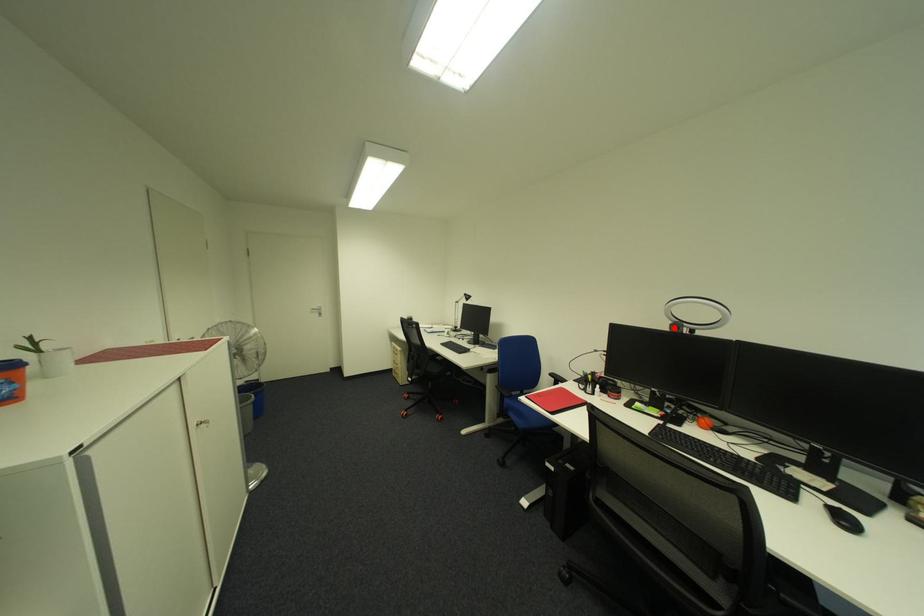
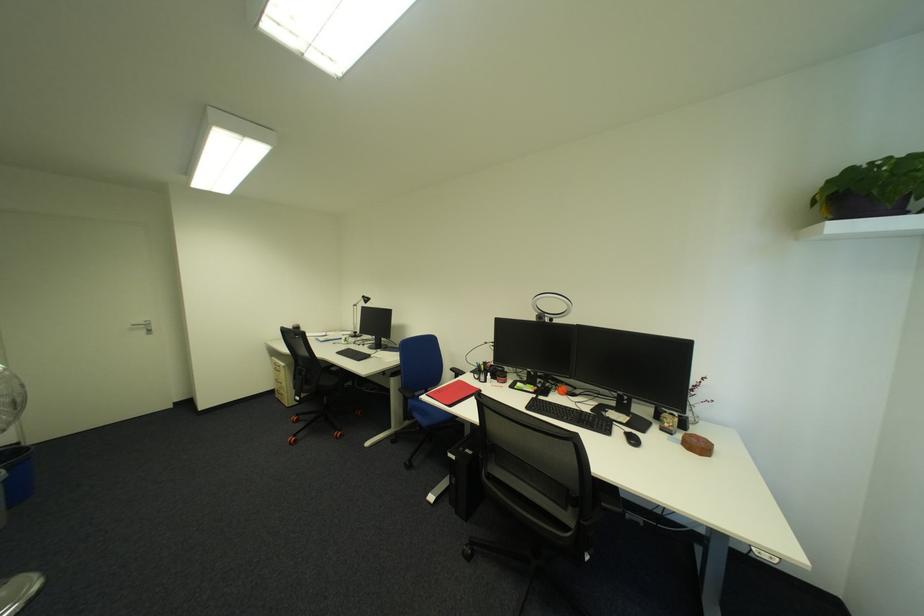
In the second image, find the point that corresponds to the highlighted location in the first image.

(542, 318)